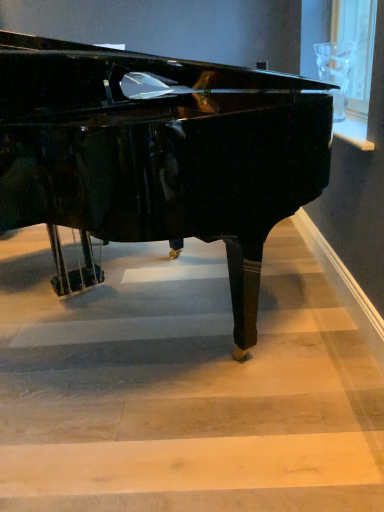
Find the location of `vacant region under glossy black piano at center (from a real-world perspective)`. vacant region under glossy black piano at center (from a real-world perspective) is located at coordinates (117, 327).